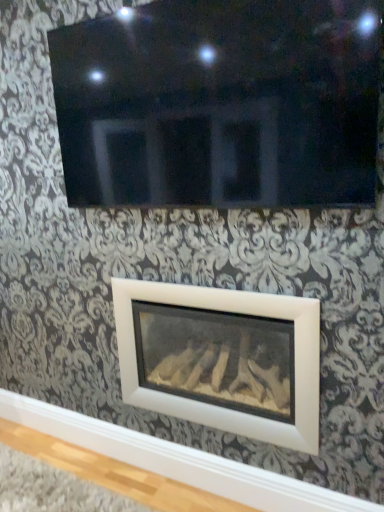
I want to click on white matte fireplace at center, so click(223, 358).

Measure the distance between white matte fireplace at center and camera.

The distance of white matte fireplace at center from camera is 4.82 feet.

What is the approximate width of white matte fireplace at center?

It is 13.90 inches.

This screenshot has height=512, width=384. Describe the element at coordinates (223, 358) in the screenshot. I see `white matte fireplace at center` at that location.

Measure the distance between point (131, 362) and camera.

Point (131, 362) is 1.94 meters away from camera.

Locate an element on the screen. This screenshot has width=384, height=512. white matte fireplace at center is located at coordinates (223, 358).